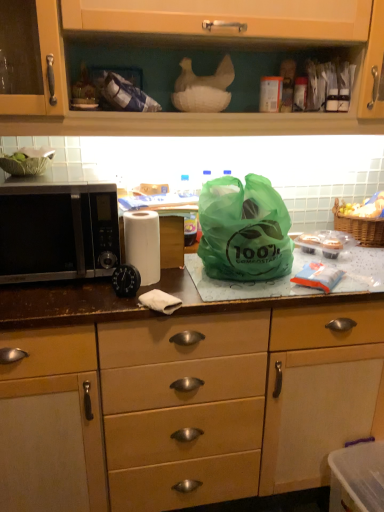
Question: From a real-world perspective, is woven brown picnic basket at right physically located above or below green translucent bag at center?

Choices:
 (A) below
 (B) above

Answer: (A)

Question: In terms of width, does woven brown picnic basket at right look wider or thinner when compared to green translucent bag at center?

Choices:
 (A) wide
 (B) thin

Answer: (B)

Question: Based on their relative distances, which object is farther from the matte wood cabinet at upper center, which is the second cabinetry in bottom-to-top order?

Choices:
 (A) green translucent bag at center
 (B) matte brown cabinet at center, which is the 2th cabinetry from top to bottom
 (C) black matte microwave at left
 (D) woven brown picnic basket at right
 (E) yellowish matte fruit at upper right

Answer: (B)

Question: Considering the real-world distances, which object is closest to the yellowish matte fruit at upper right?

Choices:
 (A) matte wood cabinet at upper center, positioned as the 1th cabinetry in top-to-bottom order
 (B) green translucent bag at center
 (C) matte brown cabinet at center, acting as the first cabinetry starting from the bottom
 (D) woven brown picnic basket at right
 (E) white matte paper towel at center

Answer: (D)